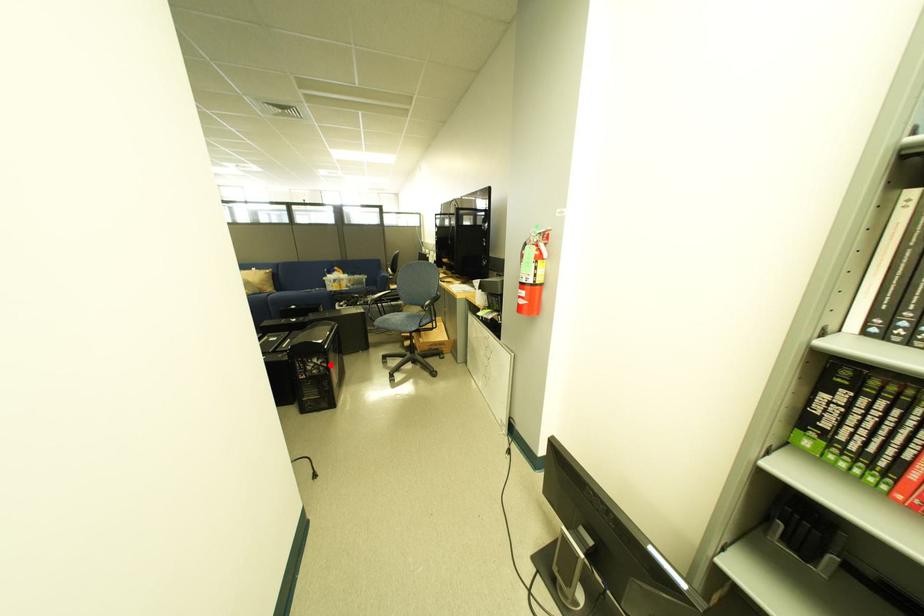
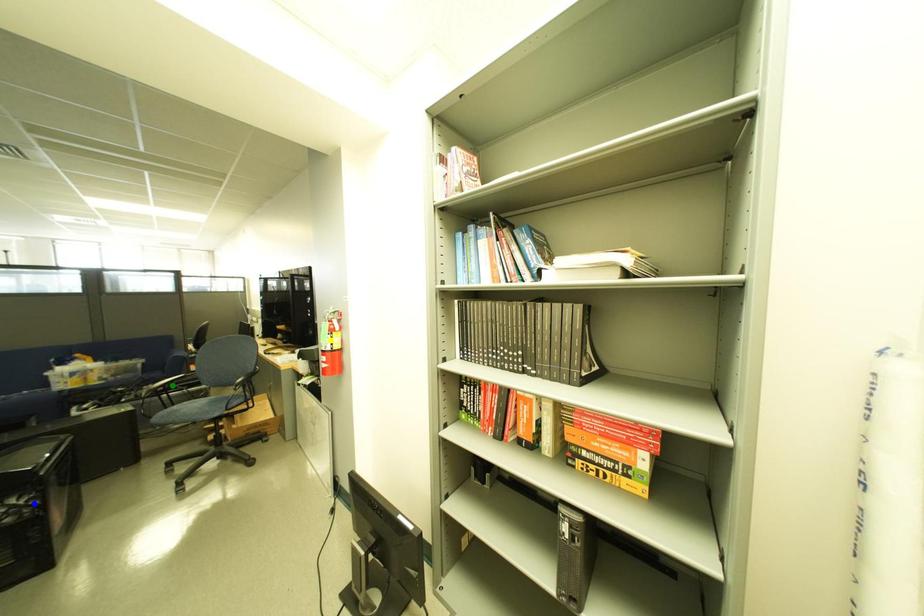
Question: I am providing you with two images of the same scene from different viewpoints. A red point is marked on the first image. You are given multiple points on the second image. Can you choose the point in image 2 that corresponds to the point in image 1?

Choices:
 (A) green point
 (B) blue point
 (C) yellow point

Answer: (B)